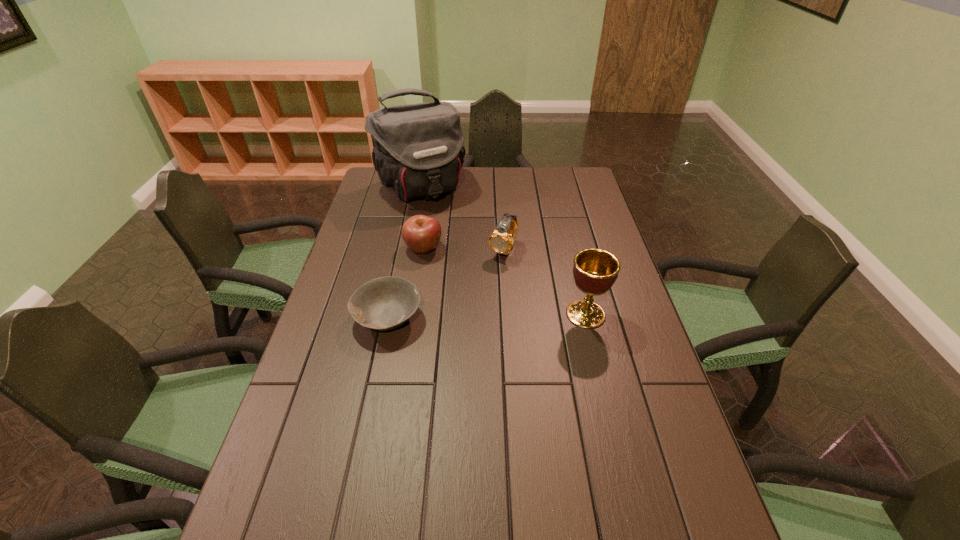
I want to click on vacant area between the tallest object and the third shortest object, so click(x=462, y=219).

You are a GUI agent. You are given a task and a screenshot of the screen. Output one action in this format:
    pyautogui.click(x=<x>, y=<y>)
    Task: Click on the blank region between the bowl and the rightmost object
    This screenshot has height=540, width=960.
    Given the screenshot: What is the action you would take?
    pyautogui.click(x=487, y=316)

Find the location of a particular element. free space between the apple and the chalice is located at coordinates (504, 281).

Where is `free space that is in between the rightmost object and the bowl`? This screenshot has height=540, width=960. free space that is in between the rightmost object and the bowl is located at coordinates (487, 316).

Locate an element on the screen. free spot between the watch and the farthest object is located at coordinates (462, 219).

This screenshot has height=540, width=960. In order to click on object that is the third closest to the second object from right to left in this screenshot , I will do `click(595, 270)`.

You are a GUI agent. You are given a task and a screenshot of the screen. Output one action in this format:
    pyautogui.click(x=<x>, y=<y>)
    Task: Click on the second closest object to the shortest object
    
    Given the screenshot: What is the action you would take?
    pyautogui.click(x=501, y=241)

Where is `vacant area in the image that satisfies the following two spatial constraints: 1. on the front side of the fourth shortest object; 2. on the right side of the third tallest object`? vacant area in the image that satisfies the following two spatial constraints: 1. on the front side of the fourth shortest object; 2. on the right side of the third tallest object is located at coordinates (508, 314).

In order to click on free space that satisfies the following two spatial constraints: 1. on the front side of the tallest object; 2. on the right side of the fourth tallest object in this screenshot , I will do `click(409, 248)`.

This screenshot has width=960, height=540. Find the location of `vacant space that satisfies the following two spatial constraints: 1. on the front side of the third shortest object; 2. on the left side of the fourth tallest object`. vacant space that satisfies the following two spatial constraints: 1. on the front side of the third shortest object; 2. on the left side of the fourth tallest object is located at coordinates tap(423, 250).